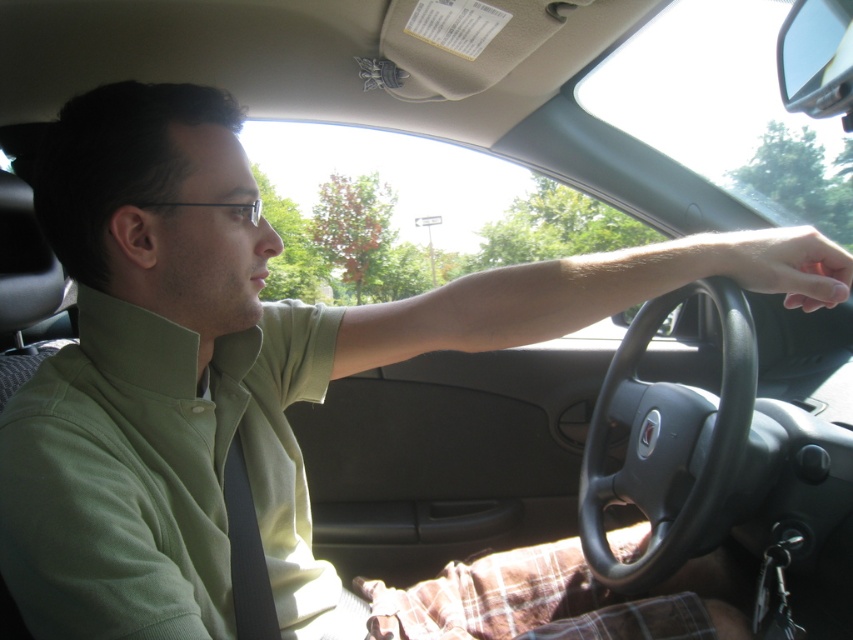
Question: Can you confirm if green fabric shirt at center is wider than dry matte skin at steering wheel?

Choices:
 (A) yes
 (B) no

Answer: (A)

Question: Which object appears farthest from the camera in this image?

Choices:
 (A) dry matte skin at steering wheel
 (B) green fabric shirt at center
 (C) black leather steering wheel at center

Answer: (A)

Question: Where is black leather steering wheel at center located in relation to dry matte skin at steering wheel in the image?

Choices:
 (A) above
 (B) below

Answer: (B)

Question: Does black leather steering wheel at center appear over dry matte skin at steering wheel?

Choices:
 (A) yes
 (B) no

Answer: (B)

Question: Estimate the real-world distances between objects in this image. Which object is farther from the dry matte skin at steering wheel?

Choices:
 (A) green fabric shirt at center
 (B) black leather steering wheel at center

Answer: (A)

Question: Which point is farther from the camera taking this photo?

Choices:
 (A) (805, 253)
 (B) (587, 540)
 (C) (202, 499)

Answer: (B)